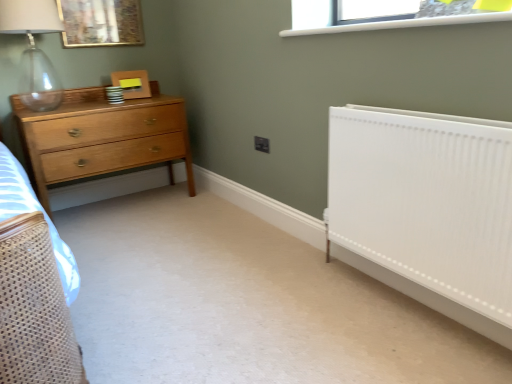
I want to click on free spot below light brown wood chest of drawers at left (from a real-world perspective), so click(142, 198).